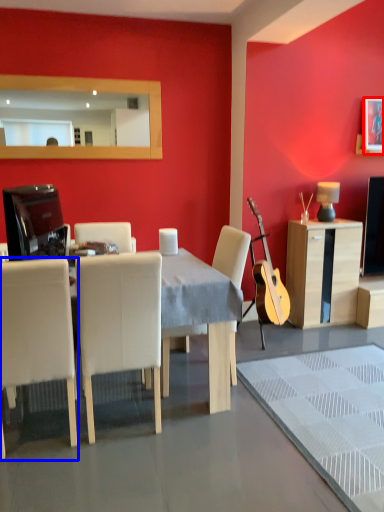
Question: Which of the following is the closest to the observer, picture frame (highlighted by a red box) or chair (highlighted by a blue box)?

Choices:
 (A) picture frame
 (B) chair

Answer: (B)